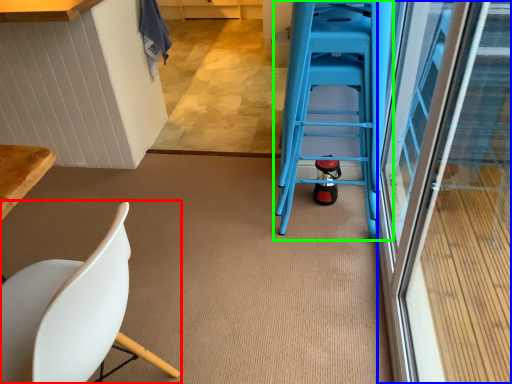
Question: Estimate the real-world distances between objects in this image. Which object is farther from chair (highlighted by a red box), screen door (highlighted by a blue box) or ladder (highlighted by a green box)?

Choices:
 (A) screen door
 (B) ladder

Answer: (A)